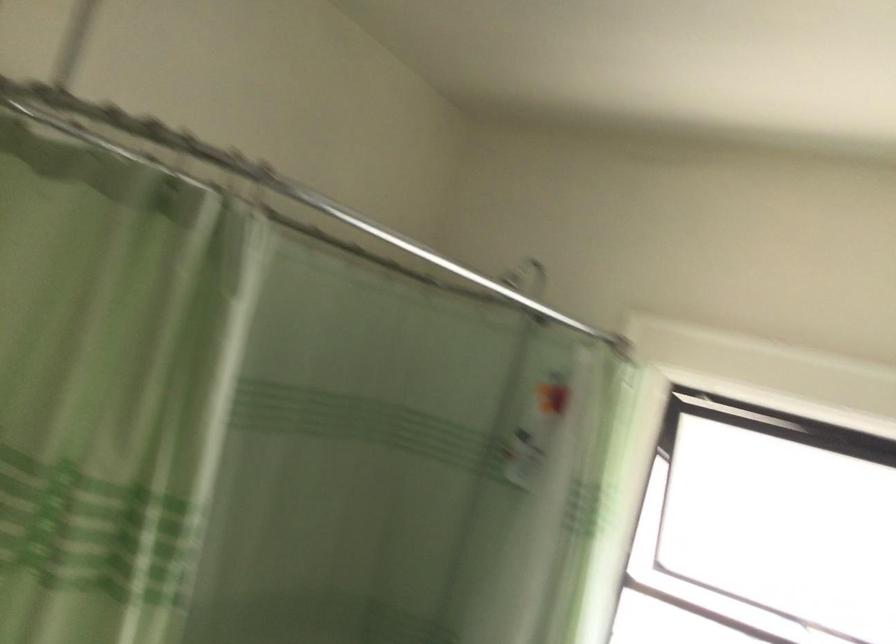
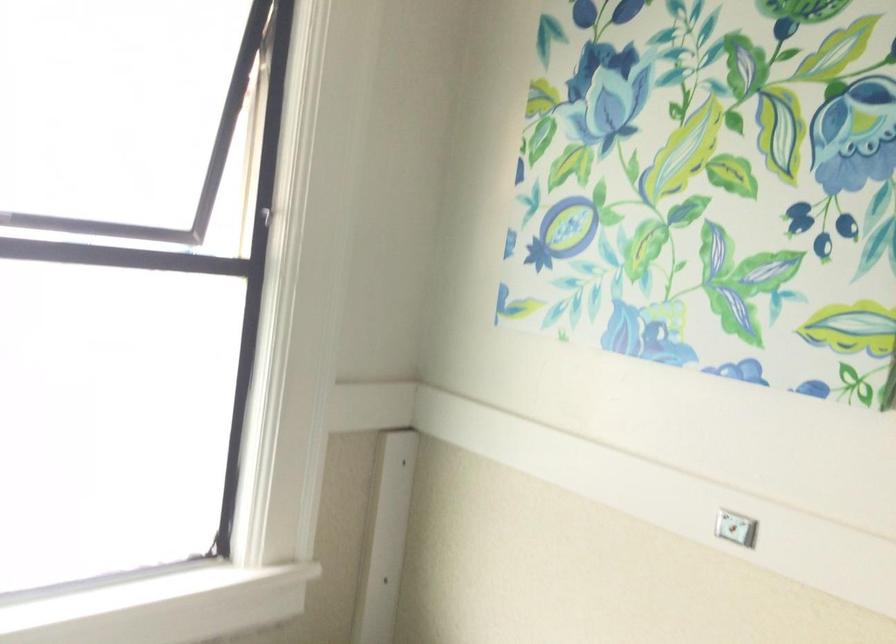
How did the camera likely rotate?

The camera rotated toward right-down.